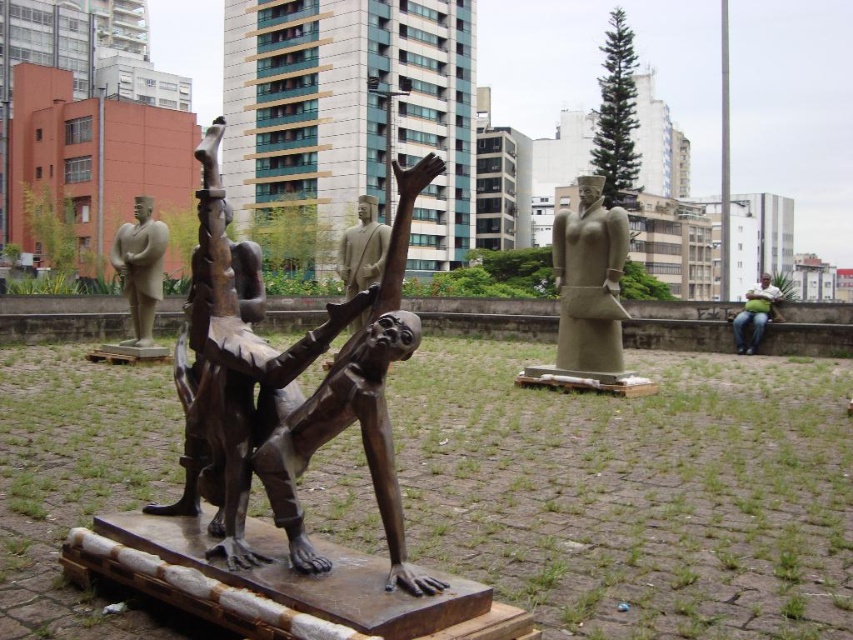
Find the location of a particular element. bronze statue at center is located at coordinates (363, 248).

Does bronze sculpture at center appear on the left side of bronze statue at center?

No, bronze sculpture at center is not to the left of bronze statue at center.

Which is above, bronze sculpture at center or bronze statue at center?

bronze statue at center is higher up.

Who is more forward, (294, 444) or (364, 221)?

Point (294, 444) is more forward.

You are a GUI agent. You are given a task and a screenshot of the screen. Output one action in this format:
    pyautogui.click(x=<x>, y=<y>)
    Task: Click on the bronze sculpture at center
    This screenshot has width=853, height=640.
    Given the screenshot: What is the action you would take?
    pyautogui.click(x=285, y=387)

Does gray stone statue at center have a greater height compared to green fabric bag at right?

Indeed, gray stone statue at center has a greater height compared to green fabric bag at right.

What do you see at coordinates (589, 298) in the screenshot? I see `gray stone statue at center` at bounding box center [589, 298].

The image size is (853, 640). Describe the element at coordinates (589, 298) in the screenshot. I see `gray stone statue at center` at that location.

Locate an element on the screen. The height and width of the screenshot is (640, 853). gray stone statue at center is located at coordinates (589, 298).